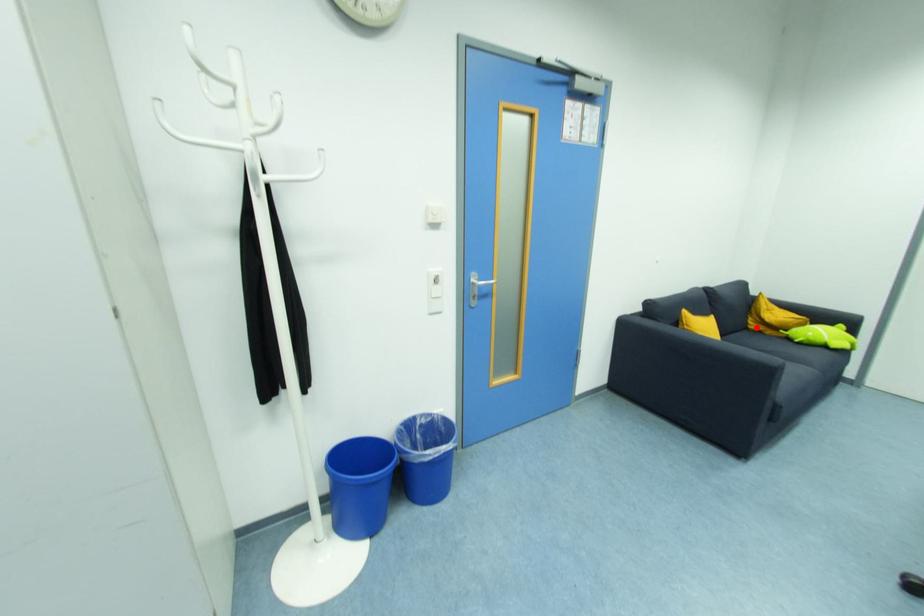
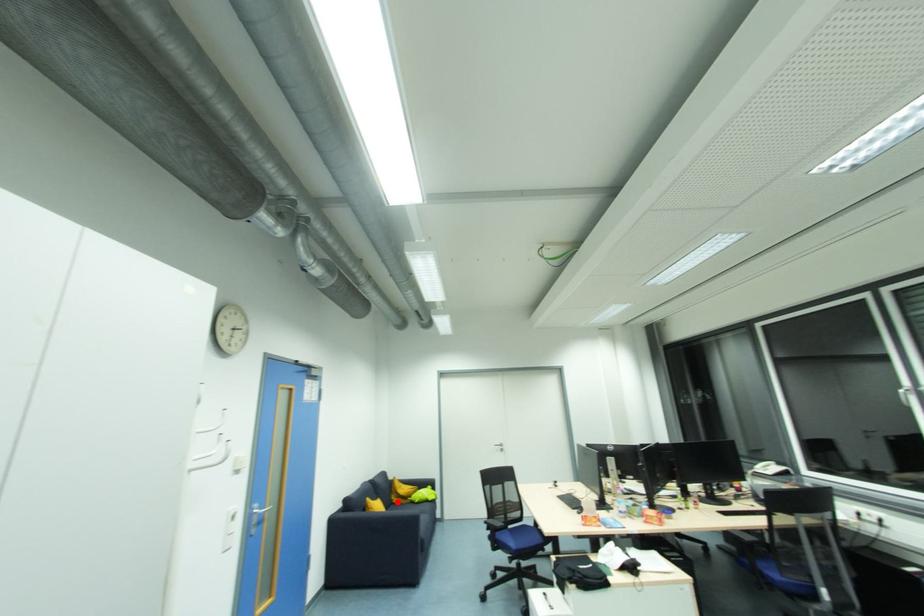
I am providing you with two images of the same scene from different viewpoints. A red point is marked on the first image and another point is marked on the second image. Is the red point in image1 aligned with the point shown in image2?

Yes